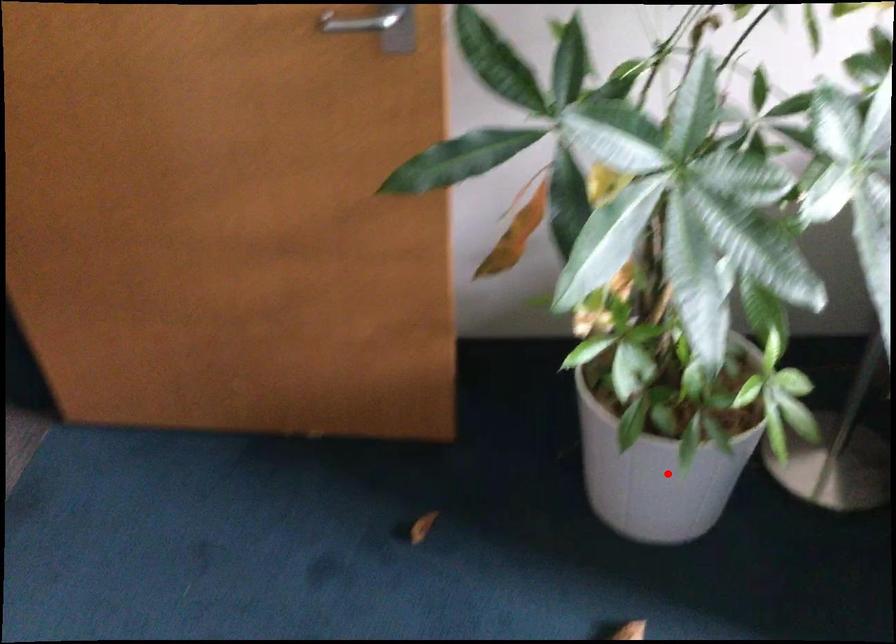
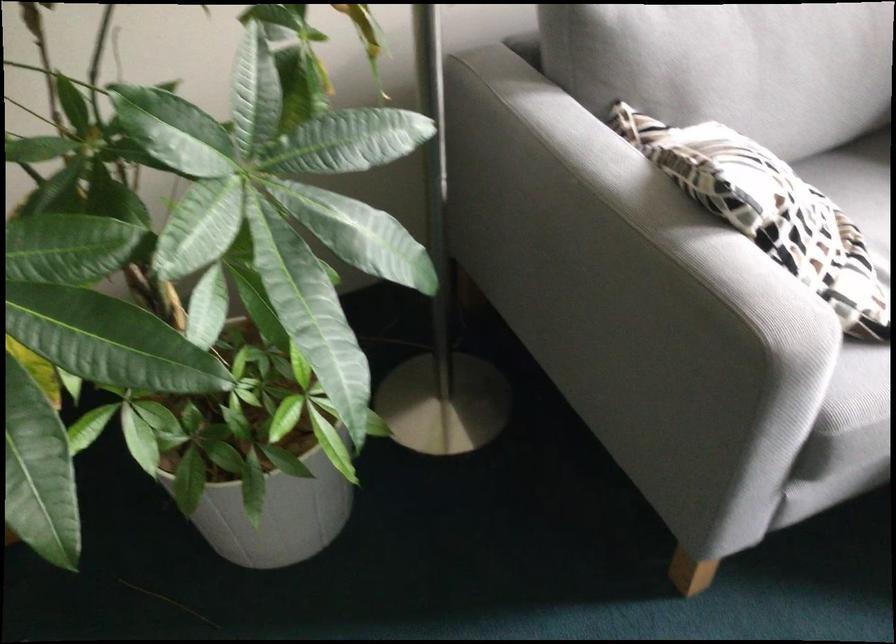
Question: I am providing you with two images of the same scene from different viewpoints. A red point is shown in image1. For the corresponding object point in image2, is it positioned nearer or farther from the camera?

Choices:
 (A) Nearer
 (B) Farther

Answer: (A)